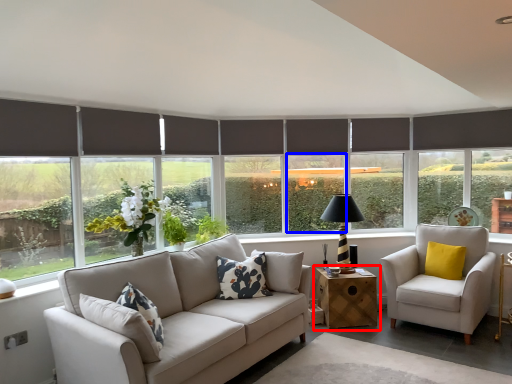
Question: Among these objects, which one is nearest to the camera, table (highlighted by a red box) or window (highlighted by a blue box)?

Choices:
 (A) table
 (B) window

Answer: (A)